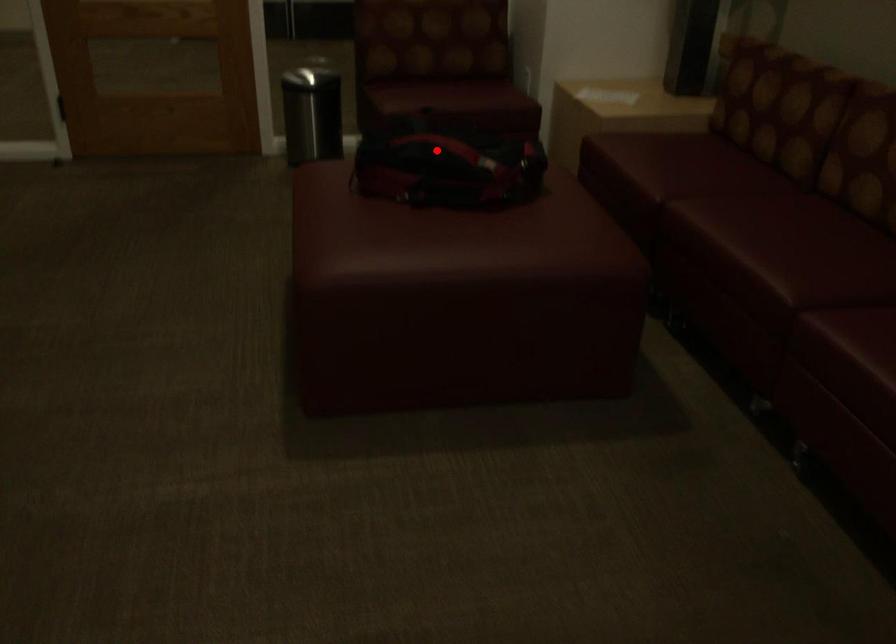
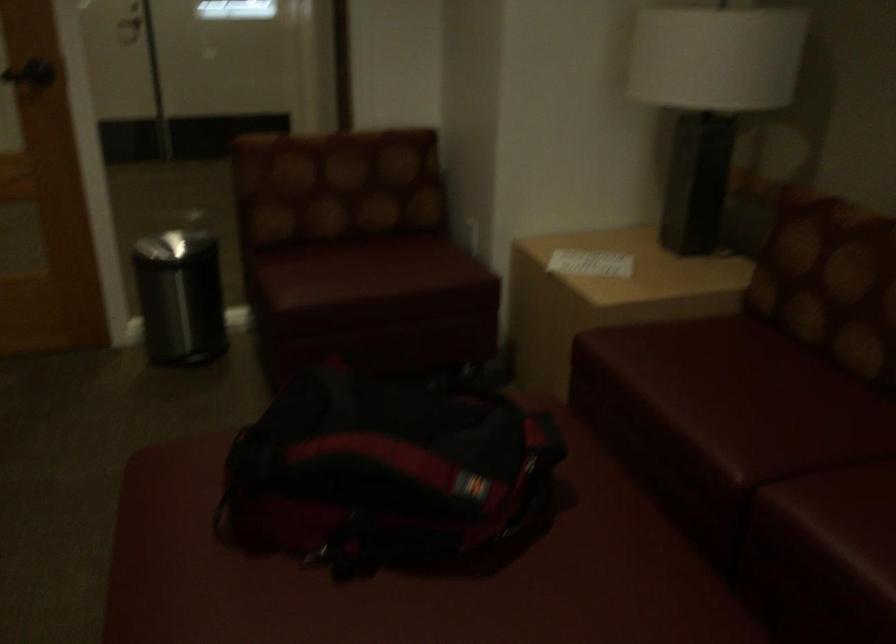
Where in the second image is the point corresponding to the highlighted location from the first image?

(384, 471)